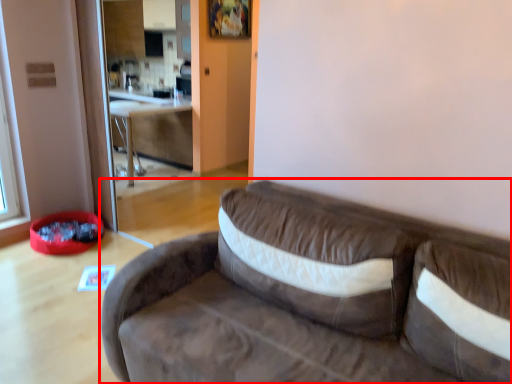
Question: Where is studio couch (annotated by the red box) located in relation to table in the image?

Choices:
 (A) left
 (B) right

Answer: (B)